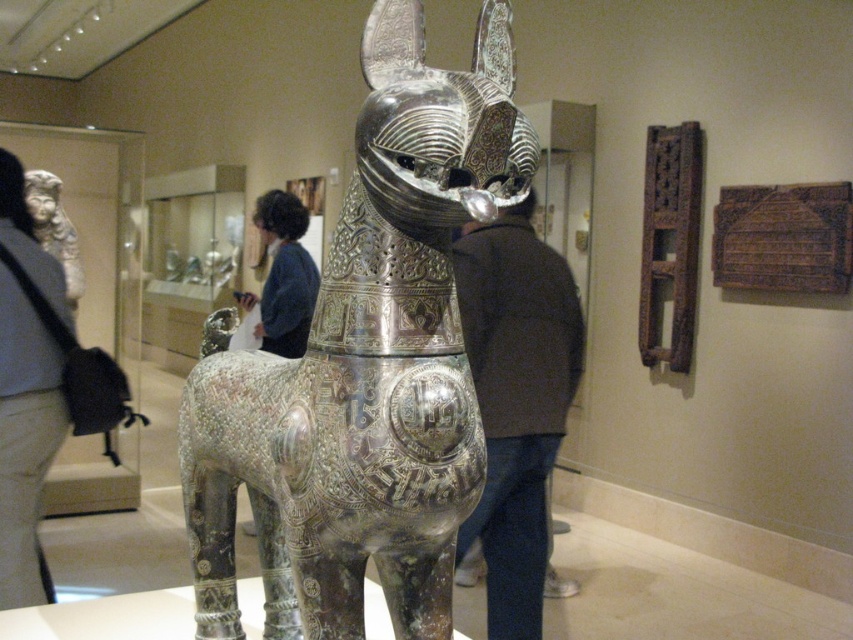
Question: Considering the relative positions of polished silver horse at center and dark brown leather jacket at center in the image provided, where is polished silver horse at center located with respect to dark brown leather jacket at center?

Choices:
 (A) below
 (B) above

Answer: (B)

Question: Which object is closer to the camera taking this photo?

Choices:
 (A) dark blue sweater at center
 (B) polished silver horse at center
 (C) light gray fabric jacket at upper left
 (D) dark brown leather jacket at center

Answer: (B)

Question: Which of the following is the farthest from the observer?

Choices:
 (A) dark blue sweater at center
 (B) light gray fabric jacket at upper left

Answer: (A)

Question: Can you confirm if polished silver horse at center is wider than dark brown leather jacket at center?

Choices:
 (A) yes
 (B) no

Answer: (A)

Question: Can you confirm if dark brown leather jacket at center is thinner than dark blue sweater at center?

Choices:
 (A) yes
 (B) no

Answer: (B)

Question: Among these objects, which one is nearest to the camera?

Choices:
 (A) polished silver horse at center
 (B) dark brown leather jacket at center
 (C) dark blue sweater at center

Answer: (A)